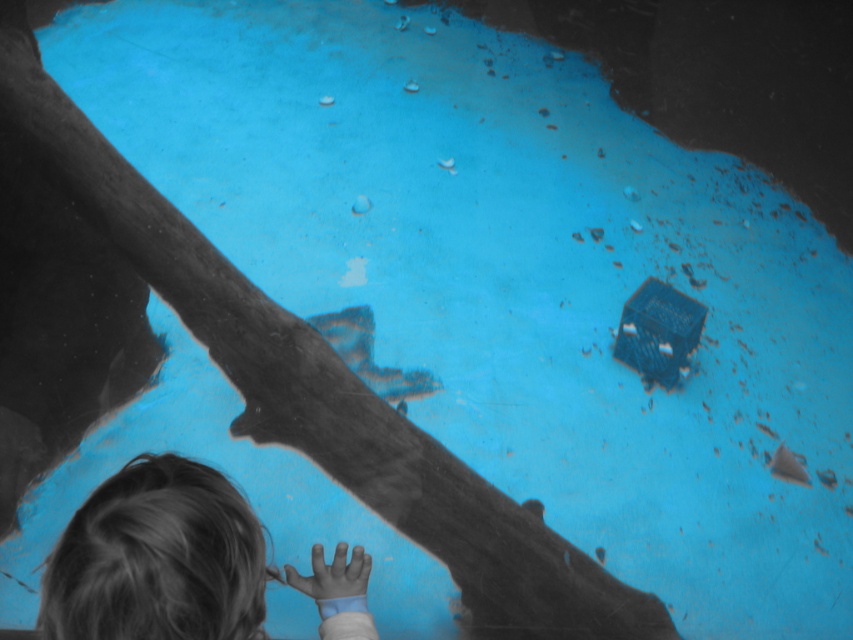
You are a zookeeper standing at the camera position. You need to place a floating toy in the water so that it is exactly 40 inches away from the camera. Is the point at coordinates point (141, 525) suitable for placing the toy?

The point at coordinates point (141, 525) is 38.43 inches away from the camera, which is 1.57 inches closer than the required 40 inches. Therefore, this point is not suitable for placing the toy.

You are a parent watching your child at the zoo. You see the blonde hair at lower left and the smooth skin hand at lower center near the water. Which object is closer to the left side of the image?

The blonde hair at lower left is closer to the left side of the image than the smooth skin hand at lower center.

You are a zookeeper observing a child interacting with the pool. The child has blonde hair at lower left and a smooth skin hand at lower center. Which part of the child is higher in the image?

The blonde hair at lower left is much taller than the smooth skin hand at lower center, so the blonde hair at lower left is higher in the image.